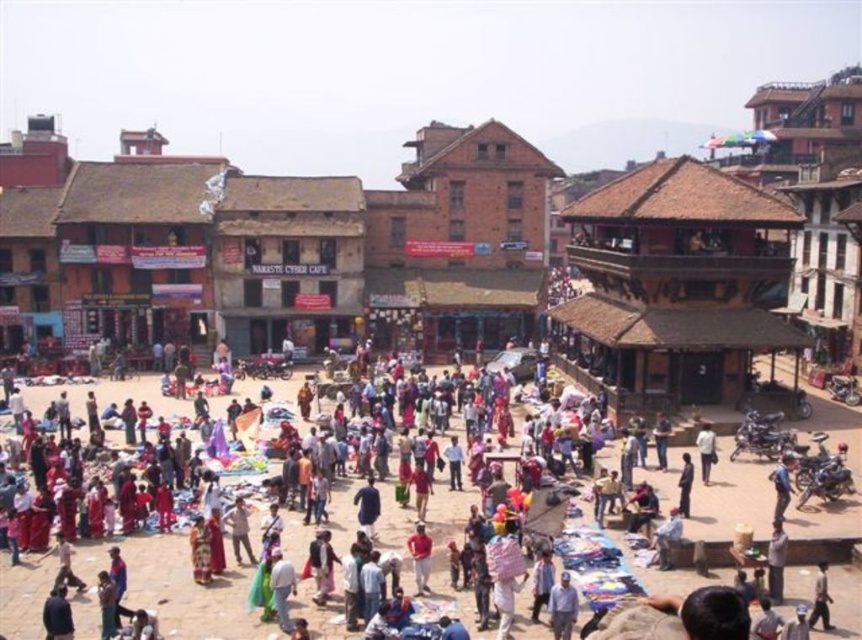
You are a tourist standing in the marketplace and want to take a photo of both the brown brick building at center and the light brown fabric shirt at center. Which object should you focus on first if you want to ensure both are in the frame?

You should focus on the brown brick building at center first because it is taller than the light brown fabric shirt at center, so adjusting the camera angle to include its height will naturally include the shorter shirt in the frame.

You are standing in the marketplace and want to take a photo of both the brown brick building at center and the red fabric person at center. Since you can only focus on one subject at a time, which one should you position closer to the camera to ensure both are in the frame?

You should position the red fabric person at center closer to the camera because the brown brick building at center is to the right of the red fabric person at center, meaning the building is further away. By moving the person closer, both will be within the frame.

You are a tourist standing at the edge of the marketplace square. You see the brown brick building at center and the red fabric person at center. Which object is closer to you?

The brown brick building at center is closer to you because the red fabric person at center is behind it.